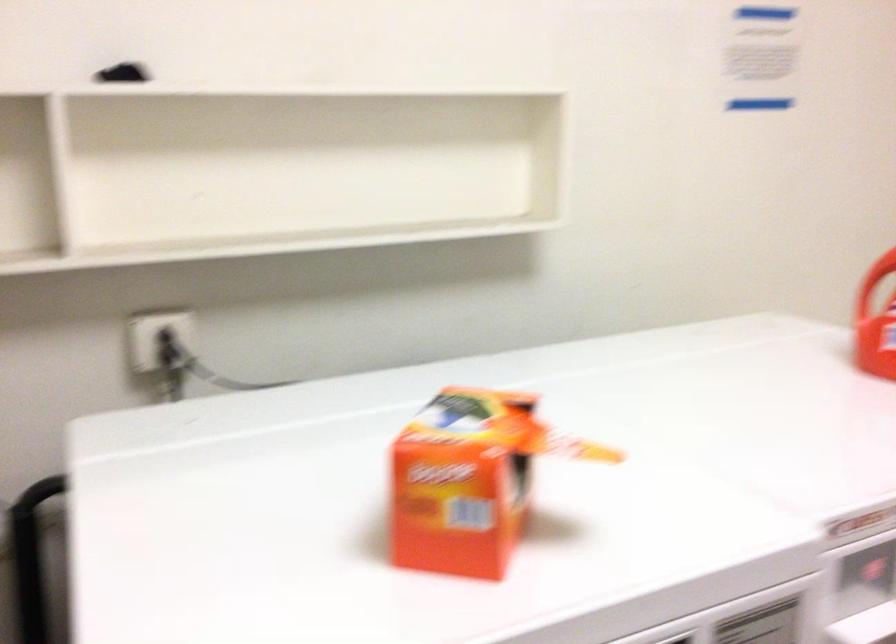
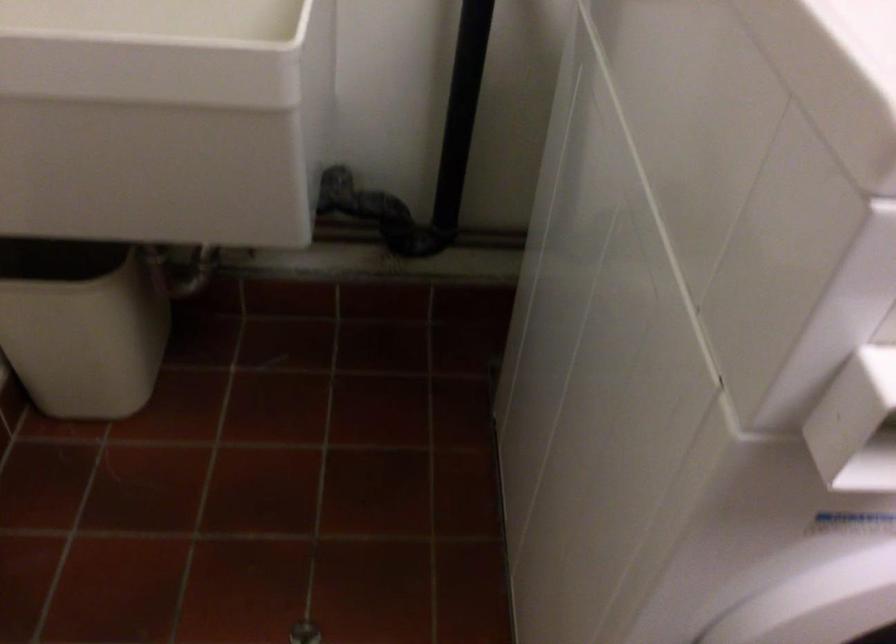
The first image is from the beginning of the video and the second image is from the end. How did the camera likely rotate when shooting the video?

The camera's rotation is toward left-down.